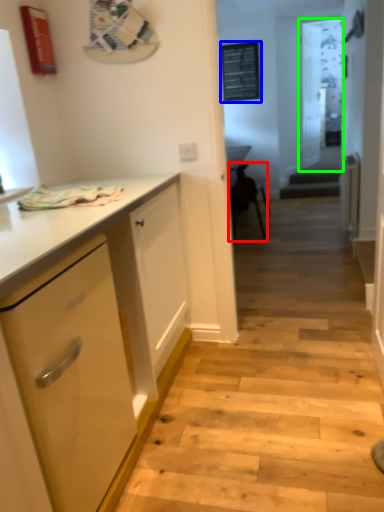
Question: Which is nearer to the chair (highlighted by a red box)? bulletin board (highlighted by a blue box) or glass door (highlighted by a green box).

Choices:
 (A) bulletin board
 (B) glass door

Answer: (A)